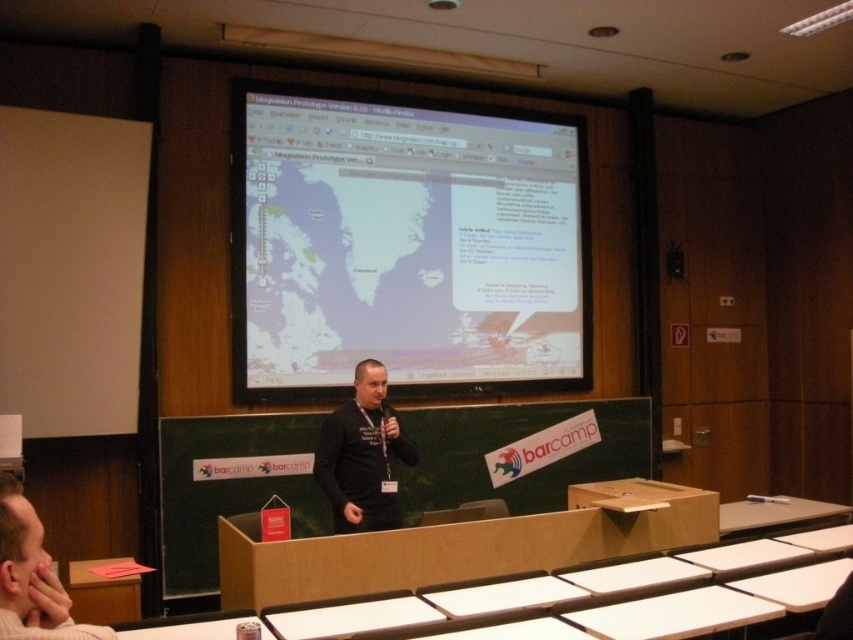
Consider the image. You are a photographer in the audience at the presentation. You want to take a photo of the speaker so that both the black matte shirt at center and the dark gray shirt at center are visible. Which shirt should be positioned to the left in the photo?

The dark gray shirt at center should be positioned to the left in the photo because the black matte shirt at center is to the right of it.

You are a guest speaker at a conference and need to adjust your position so that both the matte black projector screen at upper center and the dark gray shirt at center are visible to the audience. Considering their sizes, which object should you position closer to the front to ensure both are clearly visible?

The matte black projector screen at upper center is larger in size than the dark gray shirt at center. To ensure both are clearly visible, you should position the dark gray shirt at center closer to the front so that its smaller size doesn t get lost against the larger screen.